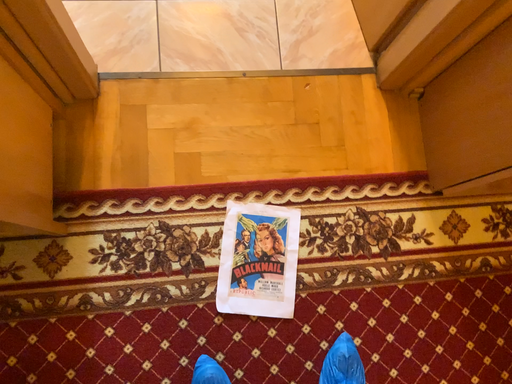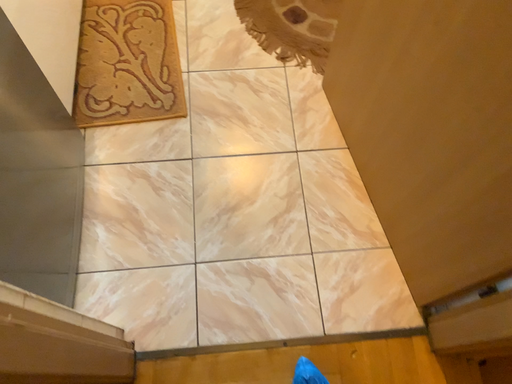
Question: How did the camera likely rotate when shooting the video?

Choices:
 (A) rotated upward
 (B) rotated downward

Answer: (A)